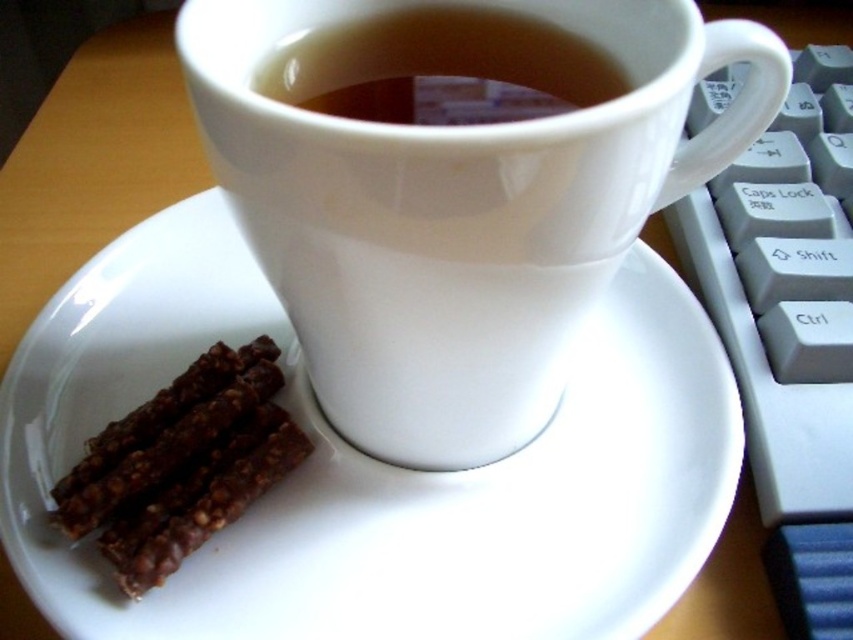
Is white ceramic mug at center above brown matte cup at upper center?

No, white ceramic mug at center is not above brown matte cup at upper center.

Which is more to the right, white ceramic mug at center or brown matte cup at upper center?

white ceramic mug at center

You are a GUI agent. You are given a task and a screenshot of the screen. Output one action in this format:
    pyautogui.click(x=<x>, y=<y>)
    Task: Click on the white ceramic mug at center
    The height and width of the screenshot is (640, 853).
    Given the screenshot: What is the action you would take?
    pyautogui.click(x=459, y=212)

Locate an element on the screen. chocolatecrumblychocolate cake at lower left is located at coordinates (183, 464).

Locate an element on the screen. Image resolution: width=853 pixels, height=640 pixels. chocolatecrumblychocolate cake at lower left is located at coordinates (183, 464).

Between white ceramic mug at center and chocolatecrumblychocolate cake at lower left, which one is positioned lower?

chocolatecrumblychocolate cake at lower left is lower down.

Is point (433, 301) farther from camera compared to point (260, 394)?

No, it is not.

Is point (186, 12) farther from viewer compared to point (148, 444)?

That is False.

You are a GUI agent. You are given a task and a screenshot of the screen. Output one action in this format:
    pyautogui.click(x=<x>, y=<y>)
    Task: Click on the white ceramic mug at center
    
    Given the screenshot: What is the action you would take?
    pyautogui.click(x=459, y=212)